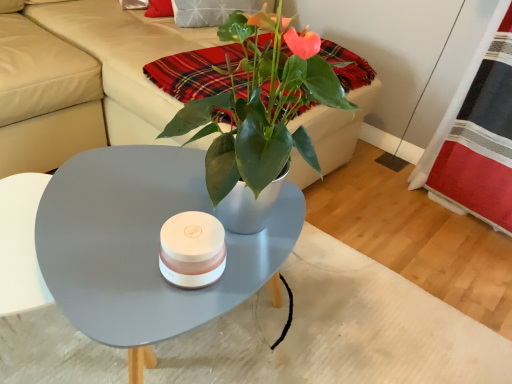
At what (x,y) coordinates should I click in order to perform the action: click on beige leather couch at upper center. Please return your answer as a coordinate pair (x, y). Looking at the image, I should click on (83, 80).

Measure the distance between point [455,168] and camera.

Point [455,168] and camera are 1.66 meters apart.

In order to click on red plaid fabric at right in this screenshot , I will do `click(477, 135)`.

Image resolution: width=512 pixels, height=384 pixels. I want to click on beige leather couch at upper center, so click(83, 80).

From the image's perspective, which is above, plaid fabric at upper center or red plaid fabric at right?

plaid fabric at upper center.

How different are the orientations of plaid fabric at upper center and red plaid fabric at right in degrees?

The angle between the facing direction of plaid fabric at upper center and the facing direction of red plaid fabric at right is 89.8 degrees.

Which point is more forward, (169, 78) or (500, 33)?

The point (169, 78) is closer to the camera.

This screenshot has width=512, height=384. Find the location of `blanket that appears above the red plaid fabric at right (from the image's perspective)`. blanket that appears above the red plaid fabric at right (from the image's perspective) is located at coordinates (194, 72).

Does matte gray coffee table at center appear on the right side of beige leather couch at upper center?

Yes, matte gray coffee table at center is to the right of beige leather couch at upper center.

Considering the sizes of objects matte gray coffee table at center and beige leather couch at upper center in the image provided, who is wider, matte gray coffee table at center or beige leather couch at upper center?

beige leather couch at upper center is wider.

Is matte gray coffee table at center next to beige leather couch at upper center and touching it?

No, matte gray coffee table at center is not making contact with beige leather couch at upper center.

How different are the orientations of red plaid fabric at right and matte gray coffee table at center in degrees?

They differ by 86.1 degrees in their facing directions.

Relative to matte gray coffee table at center, is red plaid fabric at right in front or behind?

red plaid fabric at right is behind matte gray coffee table at center.

From a real-world perspective, is red plaid fabric at right positioned over matte gray coffee table at center based on gravity?

Indeed, from a real-world perspective, red plaid fabric at right stands above matte gray coffee table at center.

Looking at this image, considering the sizes of objects red plaid fabric at right and matte gray coffee table at center in the image provided, who is smaller, red plaid fabric at right or matte gray coffee table at center?

red plaid fabric at right.

Considering the relative sizes of beige leather couch at upper center and matte gray coffee table at center in the image provided, is beige leather couch at upper center smaller than matte gray coffee table at center?

Incorrect, beige leather couch at upper center is not smaller in size than matte gray coffee table at center.

From the image's perspective, is beige leather couch at upper center on matte gray coffee table at center?

Indeed, from the image's perspective, beige leather couch at upper center is shown above matte gray coffee table at center.

Is the surface of beige leather couch at upper center in direct contact with matte gray coffee table at center?

No, beige leather couch at upper center is not in contact with matte gray coffee table at center.

Which object is positioned more to the left, beige leather couch at upper center or matte gray coffee table at center?

beige leather couch at upper center is more to the left.

I want to click on plaid below the plaid fabric at upper center (from the image's perspective), so click(477, 135).

From a real-world perspective, is red plaid fabric at right physically below plaid fabric at upper center?

Yes, from a real-world perspective, red plaid fabric at right is beneath plaid fabric at upper center.

From the image's perspective, which is above, red plaid fabric at right or plaid fabric at upper center?

From the image's view, plaid fabric at upper center is above.

Does red plaid fabric at right have a greater height compared to plaid fabric at upper center?

Yes.

From the picture: Could you tell me if beige leather couch at upper center is facing red plaid fabric at right?

Yes, beige leather couch at upper center is aimed at red plaid fabric at right.

Does beige leather couch at upper center touch red plaid fabric at right?

beige leather couch at upper center and red plaid fabric at right are clearly separated.

Between point (72, 97) and point (499, 69), which one is positioned in front?

The point (499, 69) is in front.

Find the location of a particular element. The width and height of the screenshot is (512, 384). blanket on the right of the matte gray coffee table at center is located at coordinates (194, 72).

Between point (231, 85) and point (164, 284), which one is positioned in front?

Positioned in front is point (164, 284).

Is plaid fabric at upper center with matte gray coffee table at center?

plaid fabric at upper center is not next to matte gray coffee table at center, and they're not touching.

In the image, there is a plaid fabric at upper center. At what (x,y) coordinates should I click in order to perform the action: click on plaid below it (from the image's perspective). Please return your answer as a coordinate pair (x, y). Looking at the image, I should click on (477, 135).

Locate an element on the screen. coffee table located on the right of beige leather couch at upper center is located at coordinates (144, 244).

In the scene shown: Considering their positions, is red plaid fabric at right positioned closer to matte gray coffee table at center than beige leather couch at upper center?

Based on the image, beige leather couch at upper center appears to be nearer to matte gray coffee table at center.

From the image, which object appears to be farther from red plaid fabric at right, beige leather couch at upper center or plaid fabric at upper center?

beige leather couch at upper center is further to red plaid fabric at right.

In the scene shown: When comparing their distances from beige leather couch at upper center, does matte gray coffee table at center or plaid fabric at upper center seem closer?

plaid fabric at upper center.

Which object lies further to the anchor point red plaid fabric at right, matte gray coffee table at center or plaid fabric at upper center?

Among the two, matte gray coffee table at center is located further to red plaid fabric at right.

Which object lies nearer to the anchor point red plaid fabric at right, matte gray coffee table at center or beige leather couch at upper center?

The object closer to red plaid fabric at right is matte gray coffee table at center.

Looking at the image, which one is located further to beige leather couch at upper center, plaid fabric at upper center or red plaid fabric at right?

red plaid fabric at right lies further to beige leather couch at upper center than the other object.

Considering their positions, is matte gray coffee table at center positioned closer to beige leather couch at upper center than red plaid fabric at right?

The object closer to beige leather couch at upper center is matte gray coffee table at center.

Considering their positions, is beige leather couch at upper center positioned closer to matte gray coffee table at center than plaid fabric at upper center?

plaid fabric at upper center lies closer to matte gray coffee table at center than the other object.

Find the location of a particular element. blanket between beige leather couch at upper center and red plaid fabric at right in the horizontal direction is located at coordinates (194, 72).

I want to click on blanket situated between matte gray coffee table at center and red plaid fabric at right from left to right, so click(194, 72).

At what (x,y) coordinates should I click in order to perform the action: click on blanket between beige leather couch at upper center and matte gray coffee table at center vertically. Please return your answer as a coordinate pair (x, y). Looking at the image, I should click on pos(194,72).

At what (x,y) coordinates should I click in order to perform the action: click on coffee table located between beige leather couch at upper center and red plaid fabric at right in the left-right direction. Please return your answer as a coordinate pair (x, y). Image resolution: width=512 pixels, height=384 pixels. Looking at the image, I should click on (144, 244).